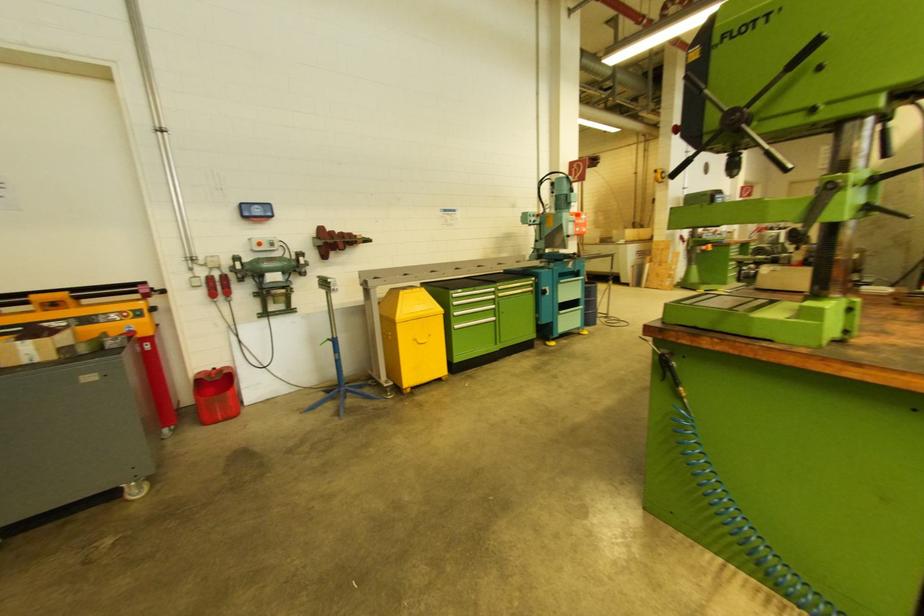
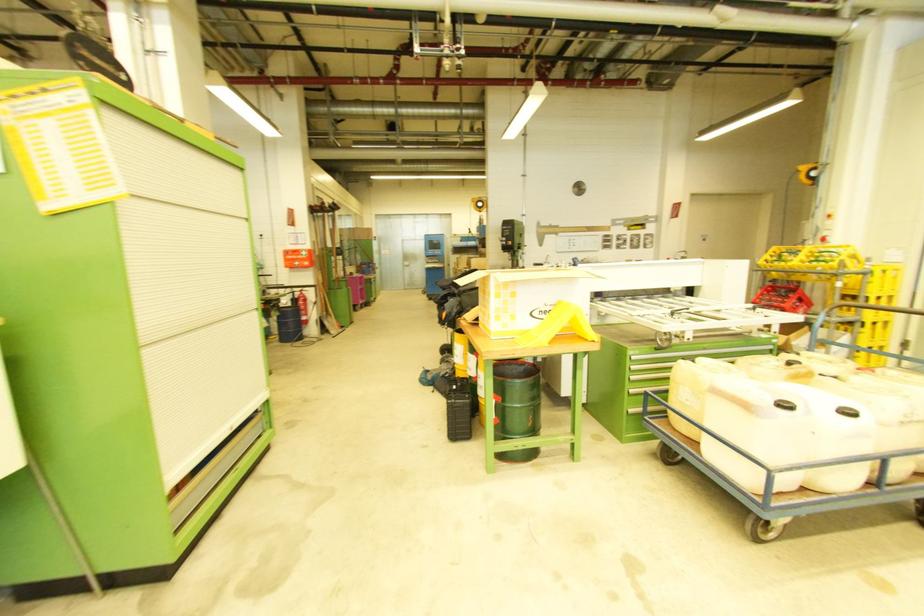
The point at (x=579, y=231) is marked in the first image. Where is the corresponding point in the second image?

(299, 265)